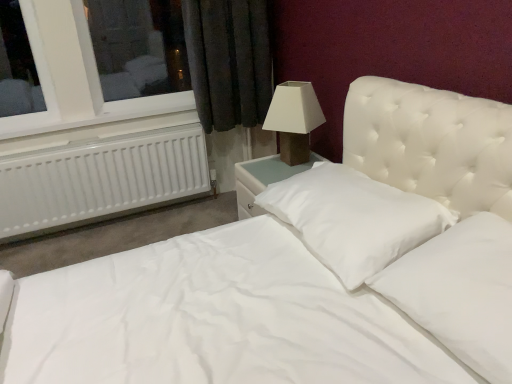
Question: Does white smooth pillow at center, which is the 1th pillow in back-to-front order, contain matte brown lamp at upper right?

Choices:
 (A) yes
 (B) no

Answer: (B)

Question: Are white smooth pillow at center, which is the 1th pillow in back-to-front order, and matte brown lamp at upper right beside each other?

Choices:
 (A) yes
 (B) no

Answer: (B)

Question: Is white smooth pillow at center, which is the 1th pillow in back-to-front order, at the left side of matte brown lamp at upper right?

Choices:
 (A) yes
 (B) no

Answer: (B)

Question: Is white smooth pillow at center, marked as the second pillow in a front-to-back arrangement, wider than matte brown lamp at upper right?

Choices:
 (A) yes
 (B) no

Answer: (A)

Question: From the image's perspective, is white smooth pillow at center, marked as the second pillow in a front-to-back arrangement, below matte brown lamp at upper right?

Choices:
 (A) no
 (B) yes

Answer: (B)

Question: Does white smooth pillow at center, which is the 1th pillow in back-to-front order, lie behind matte brown lamp at upper right?

Choices:
 (A) no
 (B) yes

Answer: (A)

Question: Does white soft pillow at center, positioned as the 1th pillow in front-to-back order, have a lesser height compared to white plastic radiator at left?

Choices:
 (A) no
 (B) yes

Answer: (B)

Question: Is white soft pillow at center, positioned as the 1th pillow in front-to-back order, at the right side of white plastic radiator at left?

Choices:
 (A) no
 (B) yes

Answer: (B)

Question: From the image's perspective, is white soft pillow at center, positioned as the 1th pillow in front-to-back order, on top of white plastic radiator at left?

Choices:
 (A) no
 (B) yes

Answer: (A)

Question: From a real-world perspective, does white soft pillow at center, positioned as the 1th pillow in front-to-back order, sit lower than white plastic radiator at left?

Choices:
 (A) yes
 (B) no

Answer: (B)

Question: Is white plastic radiator at left completely or partially inside white soft pillow at center, which is the second pillow in back-to-front order?

Choices:
 (A) no
 (B) yes

Answer: (A)

Question: Is white plastic radiator at left at the back of white soft pillow at center, which is the second pillow in back-to-front order?

Choices:
 (A) no
 (B) yes

Answer: (A)

Question: Does matte brown lamp at upper right come in front of white plastic radiator at left?

Choices:
 (A) yes
 (B) no

Answer: (A)